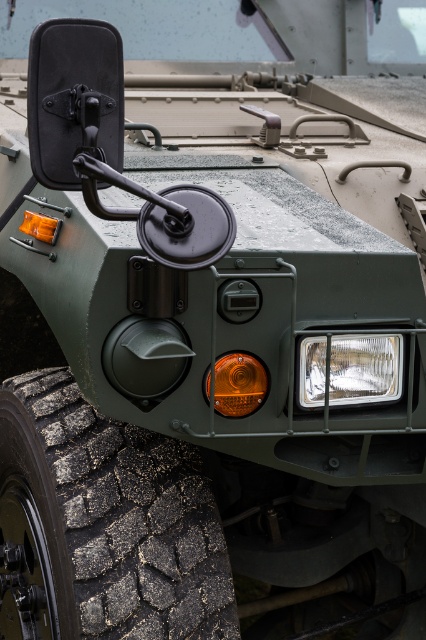
Can you confirm if black rubber tire at lower left is taller than clear plastic headlight at lower right?

Yes.

Does point (74, 580) lie in front of point (354, 392)?

Yes, it is in front of point (354, 392).

At what (x,y) coordinates should I click in order to perform the action: click on black rubber tire at lower left. Please return your answer as a coordinate pair (x, y). Looking at the image, I should click on (103, 524).